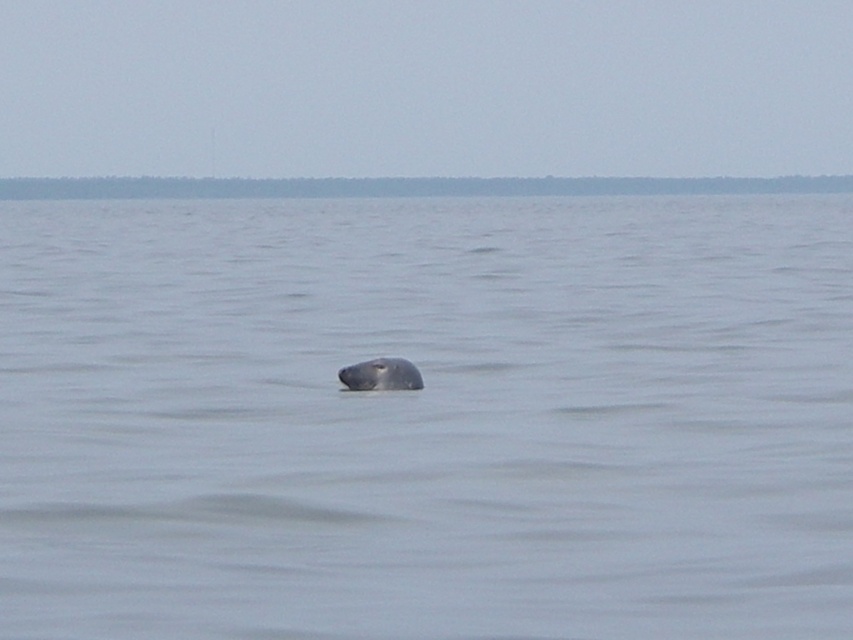
This screenshot has width=853, height=640. Describe the element at coordinates (427, 419) in the screenshot. I see `gray matte water at center` at that location.

Between gray matte water at center and gray matte whale at center, which one is positioned higher?

Positioned higher is gray matte water at center.

The image size is (853, 640). What do you see at coordinates (427, 419) in the screenshot? I see `gray matte water at center` at bounding box center [427, 419].

What are the coordinates of `gray matte water at center` in the screenshot? It's located at (427, 419).